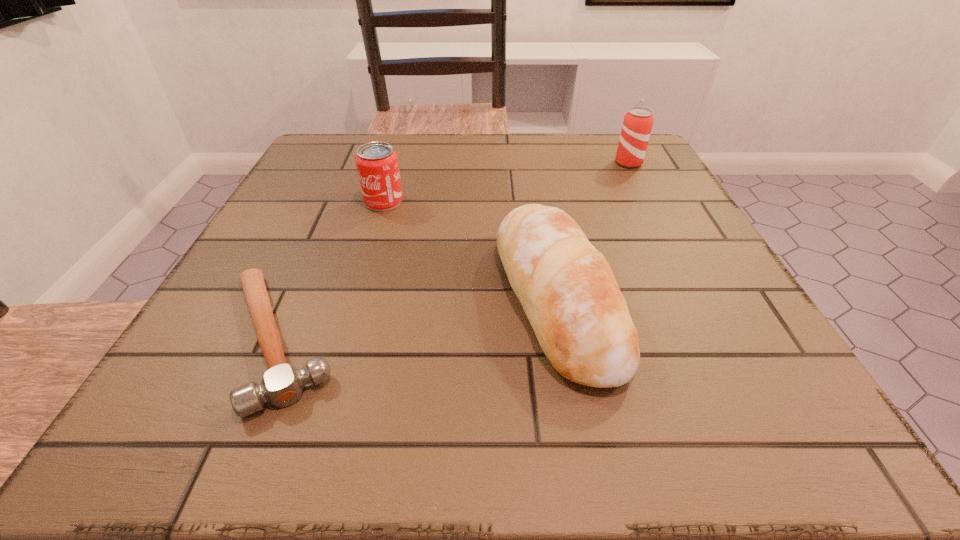
Where is `vacant area that lies between the farthest object and the can`? This screenshot has width=960, height=540. vacant area that lies between the farthest object and the can is located at coordinates (506, 183).

Image resolution: width=960 pixels, height=540 pixels. What are the coordinates of `vacant space that is in between the can and the shortest object` in the screenshot? It's located at (330, 270).

I want to click on vacant area between the beer can and the shortest object, so click(x=453, y=251).

This screenshot has width=960, height=540. Find the location of `vacant space that's between the can and the rightmost object`. vacant space that's between the can and the rightmost object is located at coordinates (506, 183).

Identify which object is located as the second nearest to the bread. Please provide its 2D coordinates. Your answer should be formatted as a tuple, i.e. [(x, y)], where the tuple contains the x and y coordinates of a point satisfying the conditions above.

[(282, 384)]

Select which object appears as the closest to the third object from left to right. Please provide its 2D coordinates. Your answer should be formatted as a tuple, i.e. [(x, y)], where the tuple contains the x and y coordinates of a point satisfying the conditions above.

[(377, 165)]

Locate an element on the screen. vacant region that satisfies the following two spatial constraints: 1. on the back side of the hammer; 2. on the right side of the farthest object is located at coordinates (355, 163).